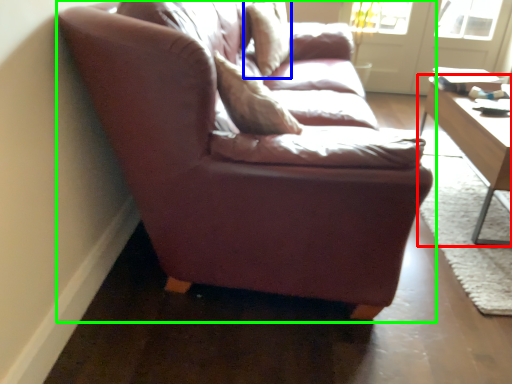
Question: Which object is positioned closest to table (highlighted by a red box)? Select from pillow (highlighted by a blue box) and studio couch (highlighted by a green box).

Choices:
 (A) pillow
 (B) studio couch

Answer: (B)